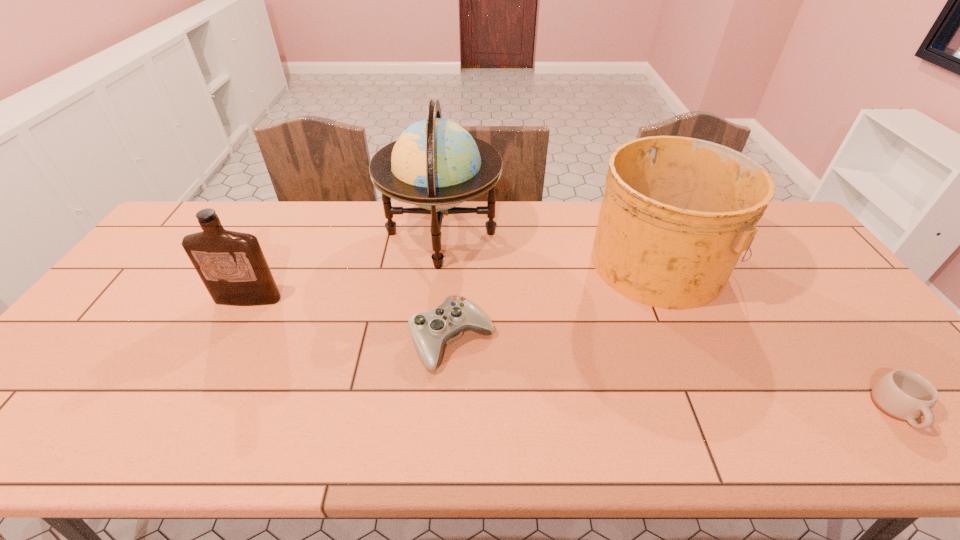
In order to click on globe present at the far edge in this screenshot , I will do click(x=436, y=164).

The width and height of the screenshot is (960, 540). Find the location of `bucket at the far edge`. bucket at the far edge is located at coordinates (x=677, y=213).

Identify the location of object present at the near edge. (904, 395).

At what (x,y) coordinates should I click in order to perform the action: click on object positioned at the right edge. Please return your answer as a coordinate pair (x, y). The image size is (960, 540). Looking at the image, I should click on (904, 395).

Locate an element on the screen. object that is at the near right corner is located at coordinates (904, 395).

In the image, there is a desktop. In order to click on free space at the far edge in this screenshot , I will do `click(526, 232)`.

This screenshot has height=540, width=960. What are the coordinates of `free space at the near edge` in the screenshot? It's located at (143, 418).

You are a GUI agent. You are given a task and a screenshot of the screen. Output one action in this format:
    pyautogui.click(x=<x>, y=<y>)
    Task: Click on the vacant point at the left edge
    The height and width of the screenshot is (540, 960).
    Given the screenshot: What is the action you would take?
    pyautogui.click(x=92, y=341)

In the image, there is a desktop. Identify the location of free space at the near left corner. The width and height of the screenshot is (960, 540). (0, 437).

Find the location of `vacant space in between the leftmost object and the control`. vacant space in between the leftmost object and the control is located at coordinates (350, 320).